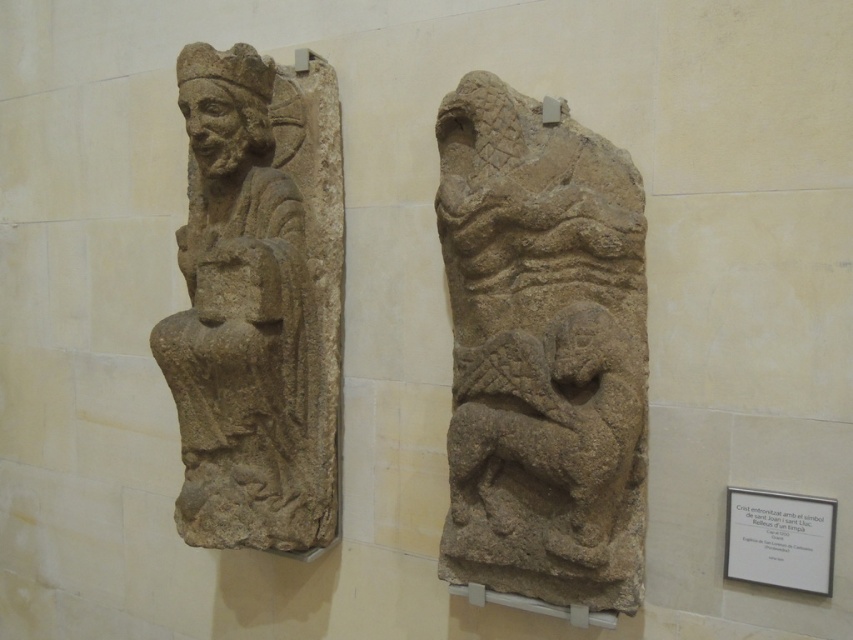
Can you confirm if gray stone dragon at right is positioned to the right of stone carving of seated figure at left?

Indeed, gray stone dragon at right is positioned on the right side of stone carving of seated figure at left.

How distant is gray stone dragon at right from stone carving of seated figure at left?

A distance of 20.80 inches exists between gray stone dragon at right and stone carving of seated figure at left.

The width and height of the screenshot is (853, 640). Describe the element at coordinates (543, 353) in the screenshot. I see `gray stone dragon at right` at that location.

I want to click on gray stone dragon at right, so click(x=543, y=353).